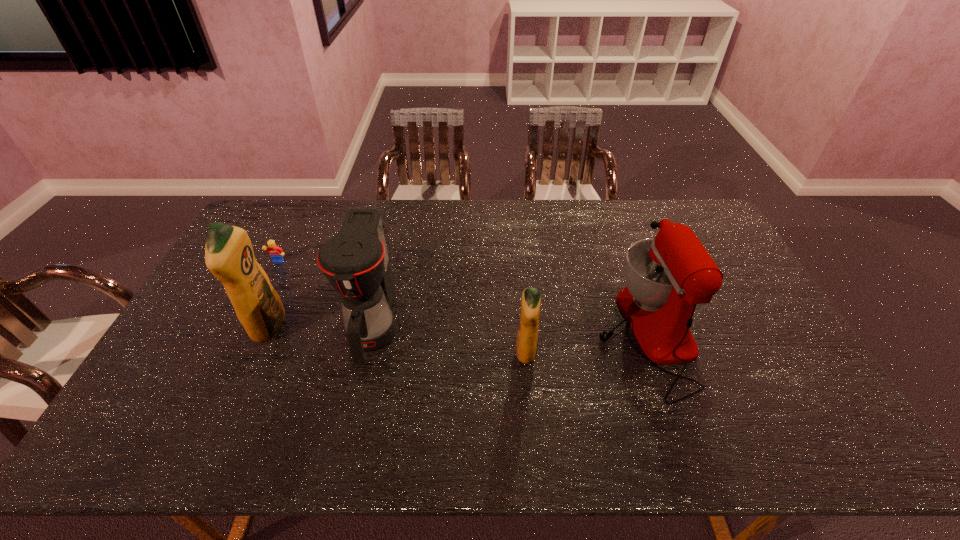
Locate an element on the screen. This screenshot has height=540, width=960. vacant space located on the label of the left detergent is located at coordinates (411, 327).

This screenshot has height=540, width=960. I want to click on vacant position located 0.210m on the label of the fourth tallest object, so click(612, 353).

Find the location of a particular element. The height and width of the screenshot is (540, 960). vacant space located on the left of the shortest object is located at coordinates pos(307,238).

Locate an element on the screen. vacant space positioned 0.230m on the face of the second shortest object is located at coordinates (251, 320).

Identify the location of free space located 0.060m pour from the carafe of the coffee maker. (357, 394).

The width and height of the screenshot is (960, 540). I want to click on vacant space located on the bowl side of the mixer, so click(506, 333).

The height and width of the screenshot is (540, 960). I want to click on free point located 0.120m on the bowl side of the mixer, so pos(555,333).

Locate an element on the screen. vacant space located 0.100m on the bowl side of the mixer is located at coordinates (562, 333).

Locate an element on the screen. This screenshot has height=540, width=960. object positioned at the far edge is located at coordinates (383, 223).

You are a GUI agent. You are given a task and a screenshot of the screen. Output one action in this format:
    pyautogui.click(x=<x>, y=<y>)
    Task: Click on the object positioned at the near edge
    The height and width of the screenshot is (540, 960).
    Given the screenshot: What is the action you would take?
    pyautogui.click(x=667, y=276)